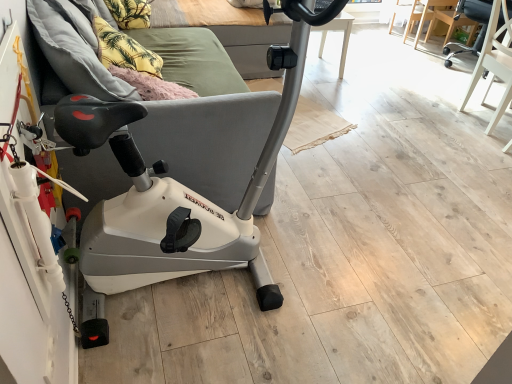
I want to click on free spot to the left of black leather swivel chair at upper right, acting as the second swivel chair starting from the front, so click(x=415, y=63).